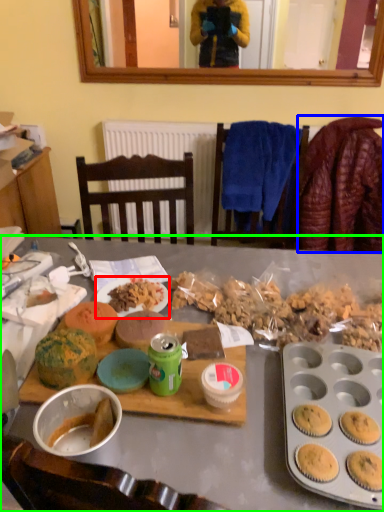
Question: Which object is the farthest from plate (highlighted by a red box)? Choose among these: blanket (highlighted by a blue box) or desk (highlighted by a green box).

Choices:
 (A) blanket
 (B) desk

Answer: (A)